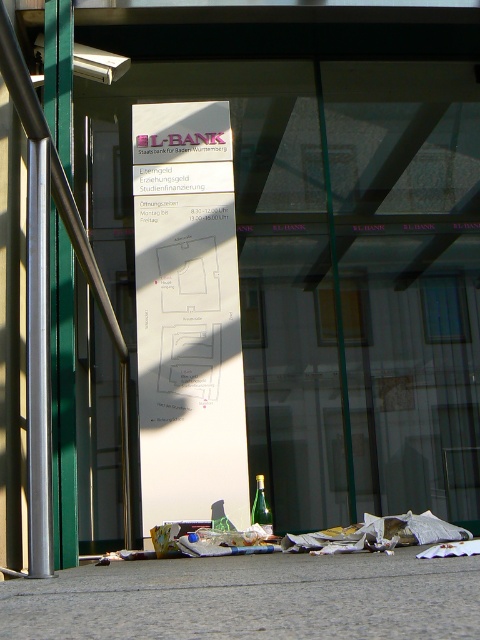
Is brushed metal rail at left below green glass bottle at lower center?

No, brushed metal rail at left is not below green glass bottle at lower center.

The image size is (480, 640). Describe the element at coordinates (67, 221) in the screenshot. I see `brushed metal rail at left` at that location.

Measure the distance between brushed metal rail at left and camera.

16.15 feet

Where is `brushed metal rail at left`? The height and width of the screenshot is (640, 480). brushed metal rail at left is located at coordinates (67, 221).

Who is more distant from viewer, (x=56, y=209) or (x=107, y=296)?

Positioned behind is point (x=107, y=296).

Between point (71, 3) and point (62, 172), which one is positioned in front?

Positioned in front is point (62, 172).

This screenshot has width=480, height=640. What are the coordinates of `silver metallic pole at left` in the screenshot? It's located at (62, 396).

Which of these two, silver metallic pole at left or green glass bottle at lower center, stands shorter?

green glass bottle at lower center

Can you confirm if silver metallic pole at left is shorter than green glass bottle at lower center?

No, silver metallic pole at left is not shorter than green glass bottle at lower center.

The height and width of the screenshot is (640, 480). What do you see at coordinates (62, 396) in the screenshot? I see `silver metallic pole at left` at bounding box center [62, 396].

In order to click on silver metallic pole at left in this screenshot , I will do `click(62, 396)`.